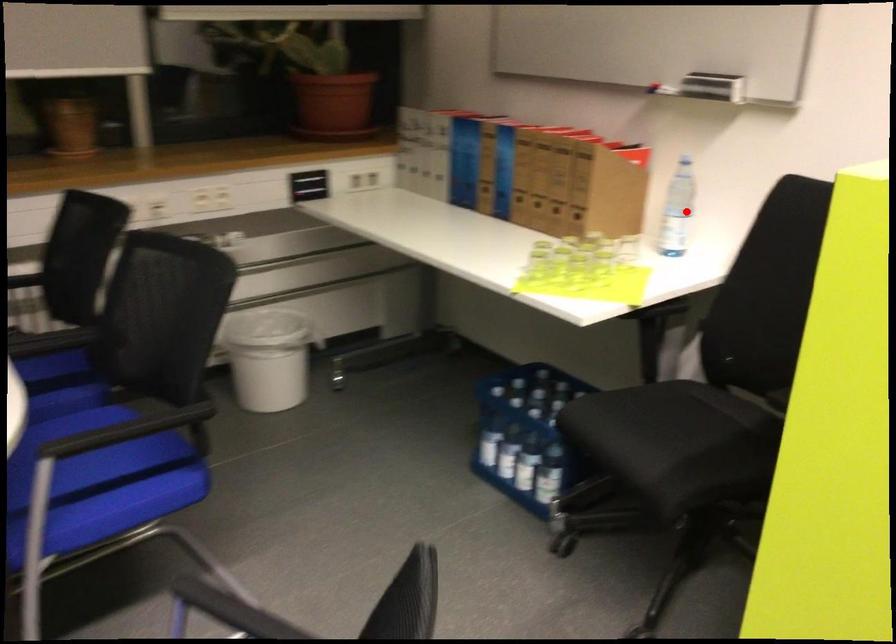
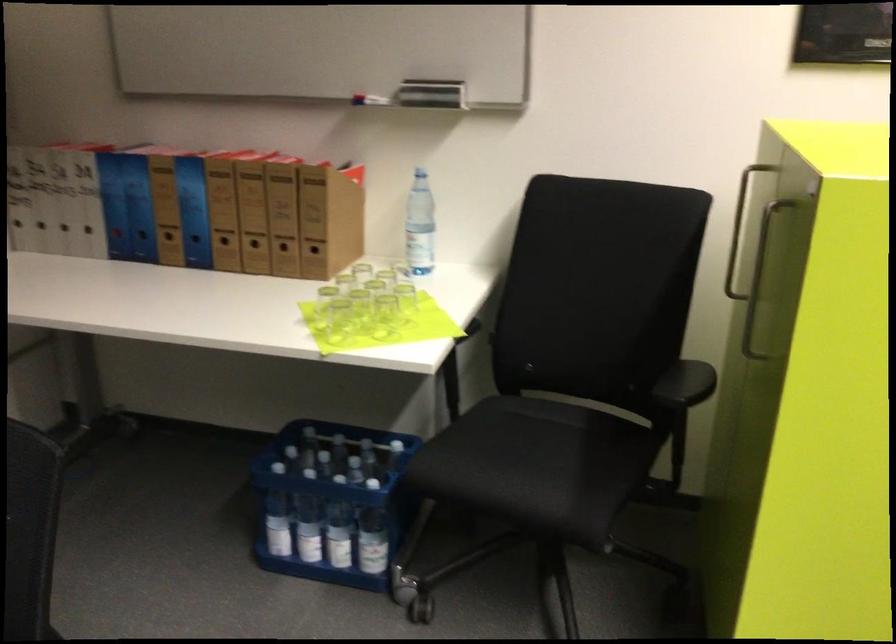
Find the pixel in the second image that matches the highlighted location in the first image.

(419, 225)